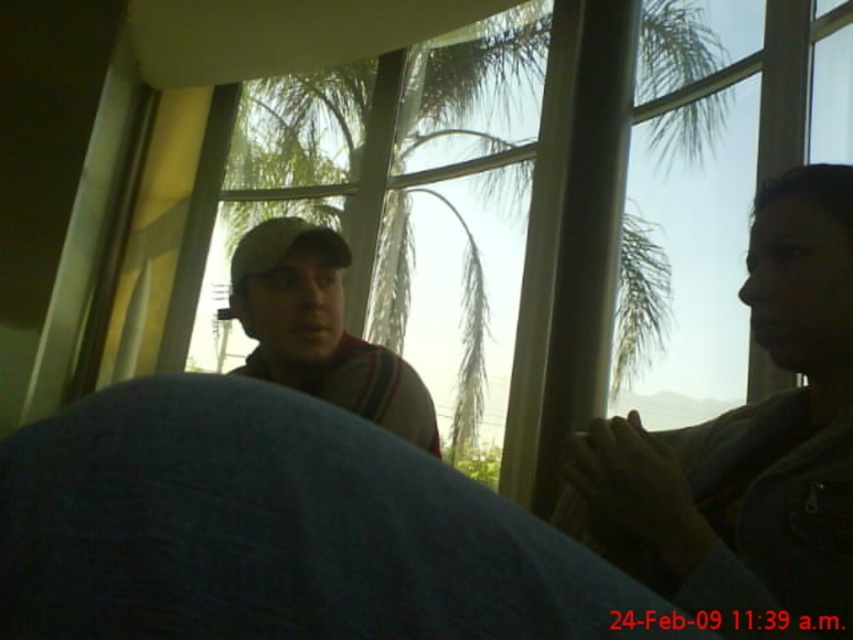
You are standing in the room and want to see the person wearing the matte beige cap at center. Is the denim jacket at right blocking your view of them?

The denim jacket at right is in front of the matte beige cap at center, so yes, the denim jacket at right is blocking the view of the person wearing the matte beige cap at center.